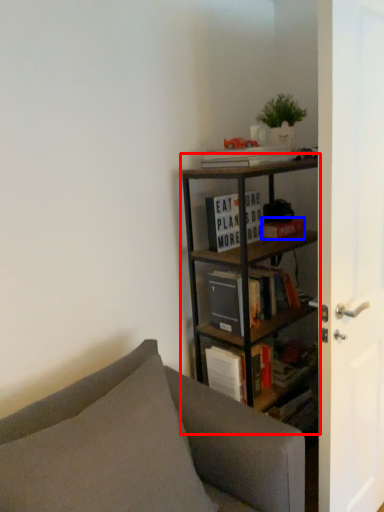
Question: Which of the following is the closest to the observer, bookcase (highlighted by a red box) or paperback book (highlighted by a blue box)?

Choices:
 (A) bookcase
 (B) paperback book

Answer: (A)